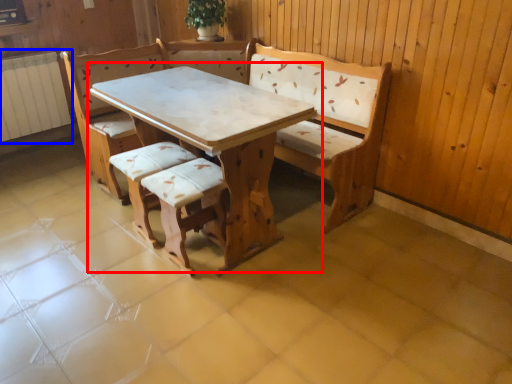
Question: Which object is closer to the camera taking this photo, table (highlighted by a red box) or radiator (highlighted by a blue box)?

Choices:
 (A) table
 (B) radiator

Answer: (A)